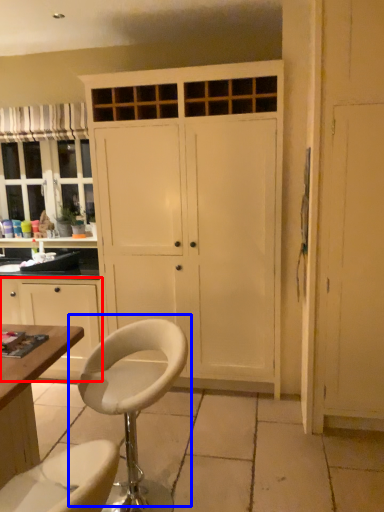
Question: Which of the following is the closest to the observer, cabinetry (highlighted by a red box) or chair (highlighted by a blue box)?

Choices:
 (A) cabinetry
 (B) chair

Answer: (B)